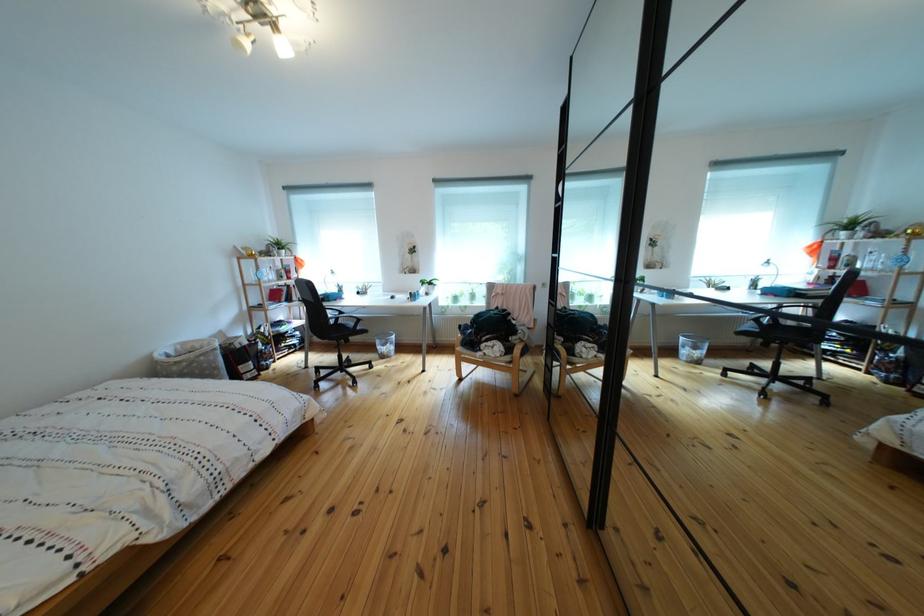
Where would you slid the black wardrobe frame? Please return your answer as a coordinate pair (x, y).

(613, 254)